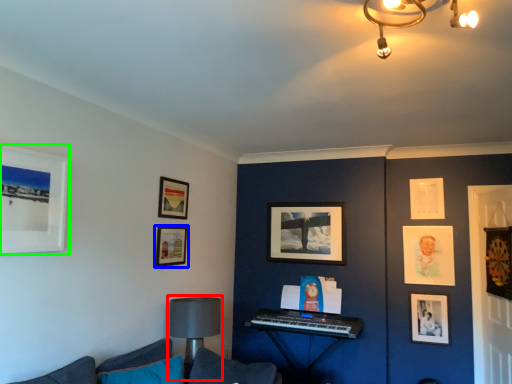
Question: Based on their relative distances, which object is nearer to table lamp (highlighted by a red box)? Choose from picture frame (highlighted by a blue box) and picture frame (highlighted by a green box).

Choices:
 (A) picture frame
 (B) picture frame

Answer: (A)